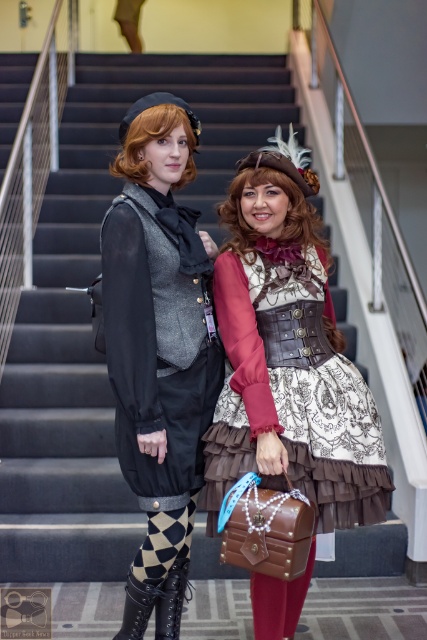
You are a photographer setting up a shoot in this scene. You need to ensure that the white lace dress at center and the black leather boot at lower center are both visible in the frame. Based on their positions, which object is closer to the camera?

The white lace dress at center is positioned over the black leather boot at lower center, meaning it is closer to the camera.

You are a photographer at the event and need to position the two subjects so that their costumes are visible. The matte black vest at center and the black leather boot at lower left are part of their outfits. Based on their current positions, which costume piece is positioned to the right of the other?

The matte black vest at center is to the right of the black leather boot at lower left.